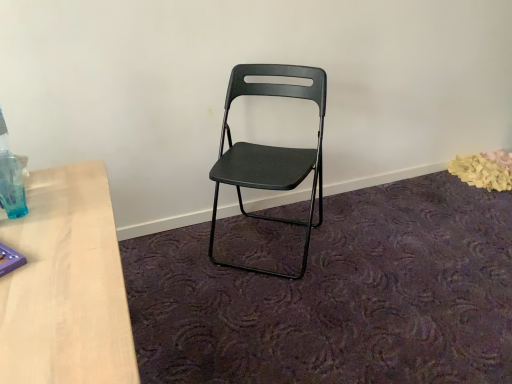
This screenshot has height=384, width=512. In order to click on spots to the right of matte black folding chair at center in this screenshot , I will do `click(362, 246)`.